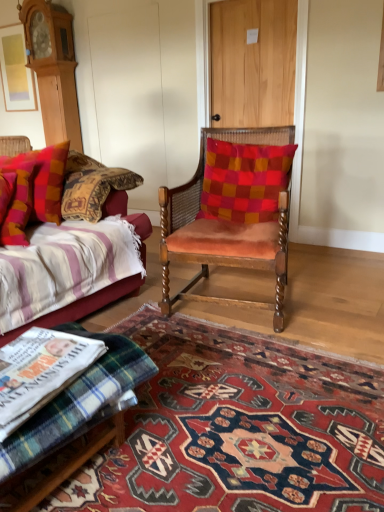
Question: From a real-world perspective, is plush cotton pillow at left, the 2th pillow in the left-to-right sequence, positioned under velvet cushion at center, placed as the 1th pillow when sorted from right to left, based on gravity?

Choices:
 (A) yes
 (B) no

Answer: (A)

Question: Is plush cotton pillow at left, the 2th pillow in the left-to-right sequence, facing towards velvet cushion at center, placed as the 1th pillow when sorted from right to left?

Choices:
 (A) yes
 (B) no

Answer: (B)

Question: Is plush cotton pillow at left, the 2th pillow in the right-to-left sequence, at the right side of velvet cushion at center, positioned as the 3th pillow in left-to-right order?

Choices:
 (A) yes
 (B) no

Answer: (B)

Question: Is plush cotton pillow at left, the 2th pillow in the right-to-left sequence, behind velvet cushion at center, positioned as the 3th pillow in left-to-right order?

Choices:
 (A) yes
 (B) no

Answer: (B)

Question: From the image's perspective, is plush cotton pillow at left, the 2th pillow in the right-to-left sequence, on velvet cushion at center, placed as the 1th pillow when sorted from right to left?

Choices:
 (A) no
 (B) yes

Answer: (A)

Question: In terms of size, does velvet striped couch at left appear bigger or smaller than velvet orange chair at center?

Choices:
 (A) small
 (B) big

Answer: (B)

Question: Would you say velvet striped couch at left is to the left or to the right of velvet orange chair at center in the picture?

Choices:
 (A) left
 (B) right

Answer: (A)

Question: Do you think velvet striped couch at left is within velvet orange chair at center, or outside of it?

Choices:
 (A) inside
 (B) outside

Answer: (B)

Question: Is velvet striped couch at left in front of or behind velvet orange chair at center in the image?

Choices:
 (A) front
 (B) behind

Answer: (A)

Question: Is plaid fabric pillow at left, positioned as the 1th pillow in left-to-right order, taller or shorter than velvet orange chair at center?

Choices:
 (A) tall
 (B) short

Answer: (B)

Question: From a real-world perspective, is plaid fabric pillow at left, the 3th pillow from the right, positioned above or below velvet orange chair at center?

Choices:
 (A) below
 (B) above

Answer: (B)

Question: From the image's perspective, is plaid fabric pillow at left, positioned as the 1th pillow in left-to-right order, located above or below velvet orange chair at center?

Choices:
 (A) below
 (B) above

Answer: (B)

Question: Is plaid fabric pillow at left, the 3th pillow from the right, in front of or behind velvet orange chair at center in the image?

Choices:
 (A) behind
 (B) front

Answer: (A)

Question: Do you think velvet striped couch at left is within carpet with intricate patterns at center, or outside of it?

Choices:
 (A) inside
 (B) outside

Answer: (B)

Question: From their relative heights in the image, would you say velvet striped couch at left is taller or shorter than carpet with intricate patterns at center?

Choices:
 (A) tall
 (B) short

Answer: (A)